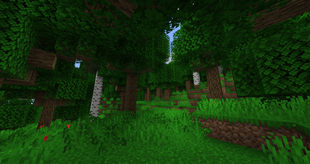
The height and width of the screenshot is (164, 310). What are the coordinates of `left corner` in the screenshot? It's located at (14, 17).